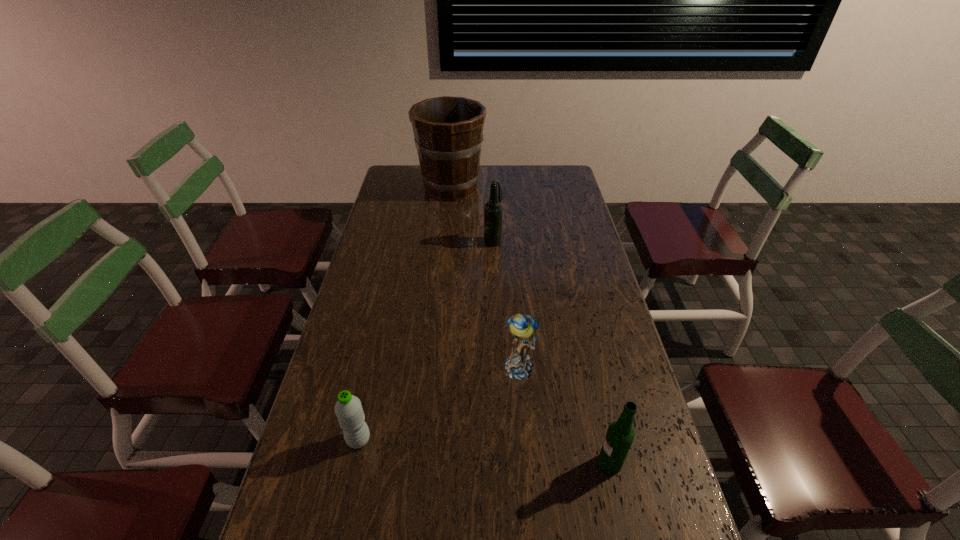
Where is `vacant area situated on the back of the farther beer bottle`? vacant area situated on the back of the farther beer bottle is located at coordinates (492, 200).

Find the location of a particular element. free region located 0.270m on the face of the third farthest object is located at coordinates (529, 484).

The height and width of the screenshot is (540, 960). Identify the location of blank area located 0.080m on the label of the nearer beer bottle. (564, 463).

Find the location of a particular element. The width and height of the screenshot is (960, 540). free location located 0.270m on the label of the nearer beer bottle is located at coordinates (484, 463).

Where is `free space located on the label of the nearer beer bottle`? free space located on the label of the nearer beer bottle is located at coordinates (468, 463).

I want to click on free spot located 0.100m on the back of the water bottle, so click(369, 395).

Image resolution: width=960 pixels, height=540 pixels. What are the coordinates of `object located at the far edge` in the screenshot? It's located at (448, 131).

Identify the location of bucket that is at the left edge. The width and height of the screenshot is (960, 540). (448, 131).

Image resolution: width=960 pixels, height=540 pixels. What are the coordinates of `water bottle at the left edge` in the screenshot? It's located at (348, 409).

Identify the location of object at the right edge. (620, 435).